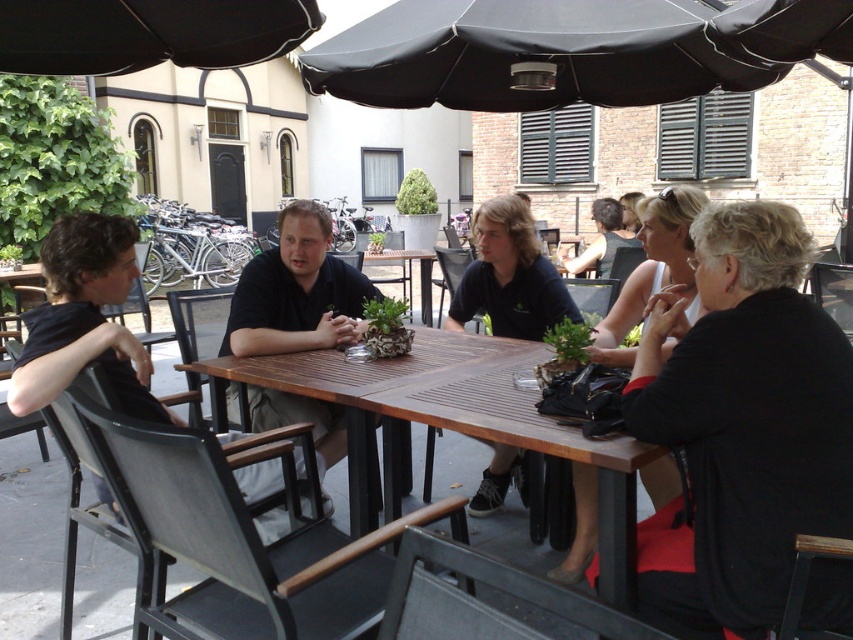
You are a customer at the outdoor cafe and want to order a drink. You notice two black fabric umbrellas in the scene. Which umbrella is closer to you, the black fabric umbrella at upper center or the black fabric umbrella at upper left?

The black fabric umbrella at upper center is closer to you because the black fabric umbrella at upper left is behind it.

You are a customer at the outdoor cafe and want to choose a table under an umbrella. There are two black fabric umbrellas available. Which one would provide more shade coverage for your table? Please refer to the black fabric umbrella at upper center and the black fabric umbrella at upper left in your answer.

The black fabric umbrella at upper center is larger in size than the black fabric umbrella at upper left, so it would provide more shade coverage for your table.

You are a photographer setting up a camera at the back of the scene. You want to take a photo of the black fabric dress at right and the dark blue shirt at center so that both are fully visible. Based on their heights, which object should you position closer to the camera to ensure both are fully captured?

The black fabric dress at right is not as tall as the dark blue shirt at center, so you should position the dark blue shirt at center closer to the camera to ensure both are fully visible.